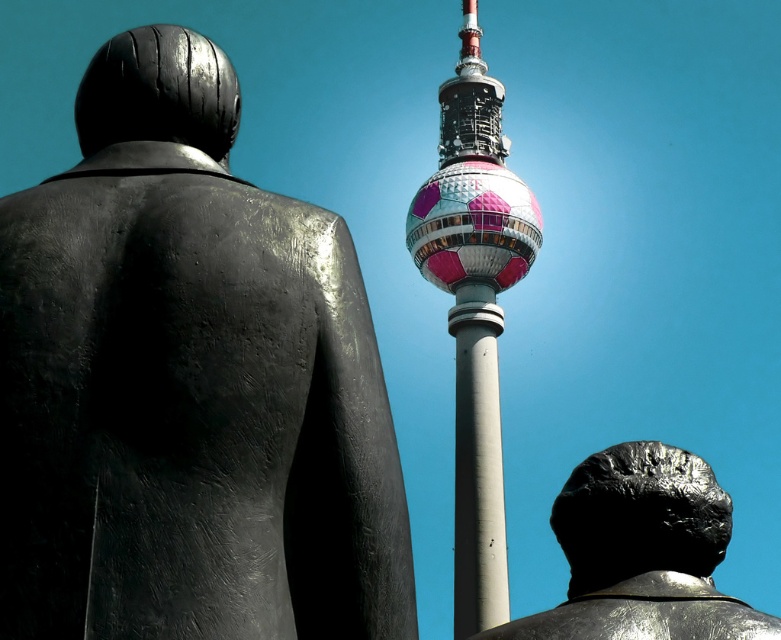
Does matte black statue at left have a greater height compared to polished bronze head at right?

Incorrect, matte black statue at left's height is not larger of polished bronze head at right's.

Which is more to the left, matte black statue at left or polished bronze head at right?

matte black statue at left

Does point (316, 282) come closer to viewer compared to point (665, 460)?

Yes, point (316, 282) is in front of point (665, 460).

The image size is (781, 640). Find the location of `matte black statue at left`. matte black statue at left is located at coordinates (188, 385).

Is the position of matte black statue at left more distant than that of shiny metallic tower at center?

No, matte black statue at left is in front of shiny metallic tower at center.

Can you confirm if matte black statue at left is wider than shiny metallic tower at center?

In fact, matte black statue at left might be narrower than shiny metallic tower at center.

Is point (98, 336) positioned before point (459, 52)?

Yes, it is in front of point (459, 52).

What are the coordinates of `matte black statue at left` in the screenshot? It's located at click(x=188, y=385).

Looking at this image, between shiny metallic tower at center and polished bronze head at right, which one has less height?

With less height is polished bronze head at right.

Between shiny metallic tower at center and polished bronze head at right, which one is positioned lower?

Positioned lower is shiny metallic tower at center.

This screenshot has height=640, width=781. Describe the element at coordinates (473, 308) in the screenshot. I see `shiny metallic tower at center` at that location.

Find the location of a particular element. shiny metallic tower at center is located at coordinates (473, 308).